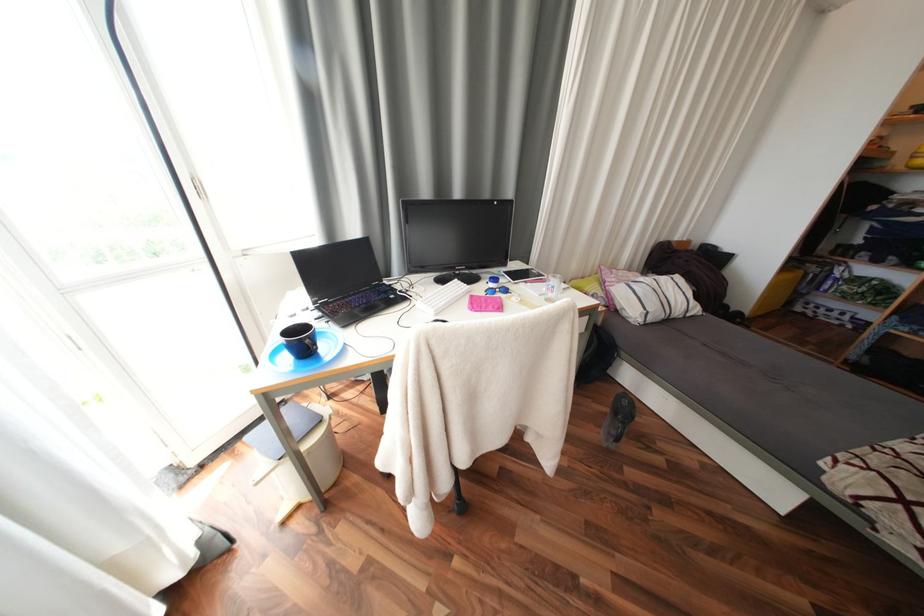
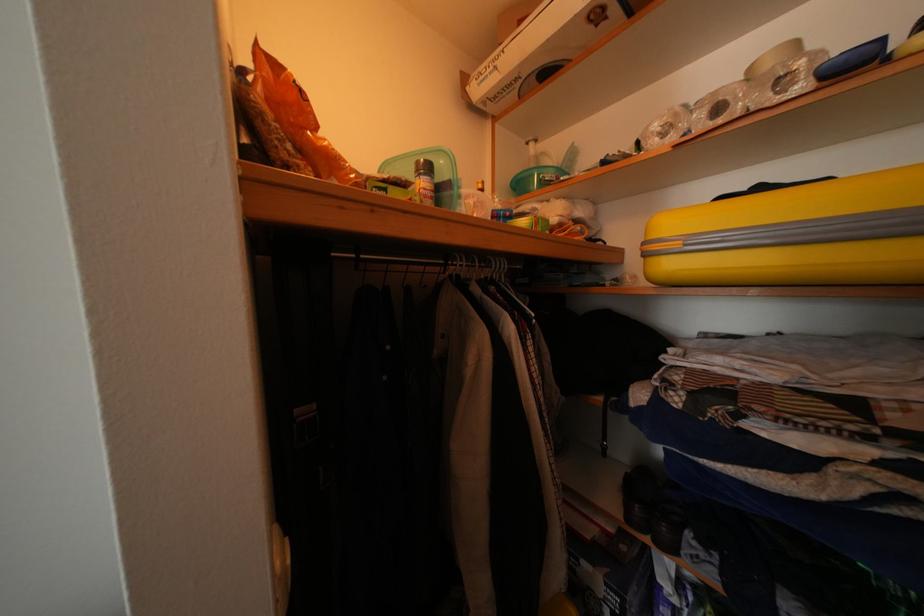
The images are taken continuously from a first-person perspective. In which direction are you moving?

The cameraman walked toward right, forward.